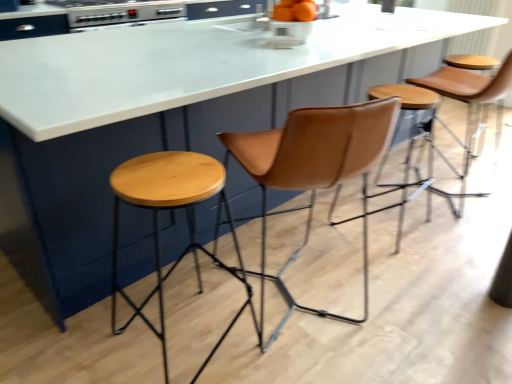
This screenshot has height=384, width=512. In order to click on free space underneath brown leather swivel chair at center (from a real-world perspective) in this screenshot , I will do `click(308, 301)`.